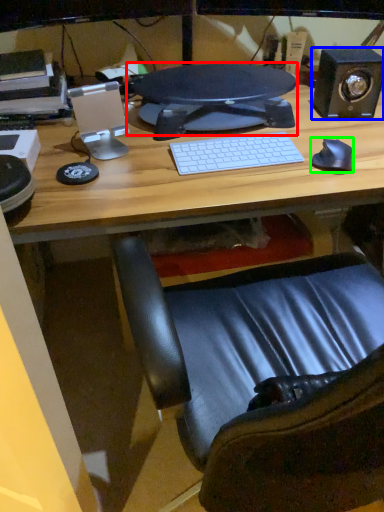
Question: Which object is the closest to the computer monitor (highlighted by a red box)? Choose among these: speaker (highlighted by a blue box) or mouse (highlighted by a green box).

Choices:
 (A) speaker
 (B) mouse

Answer: (A)